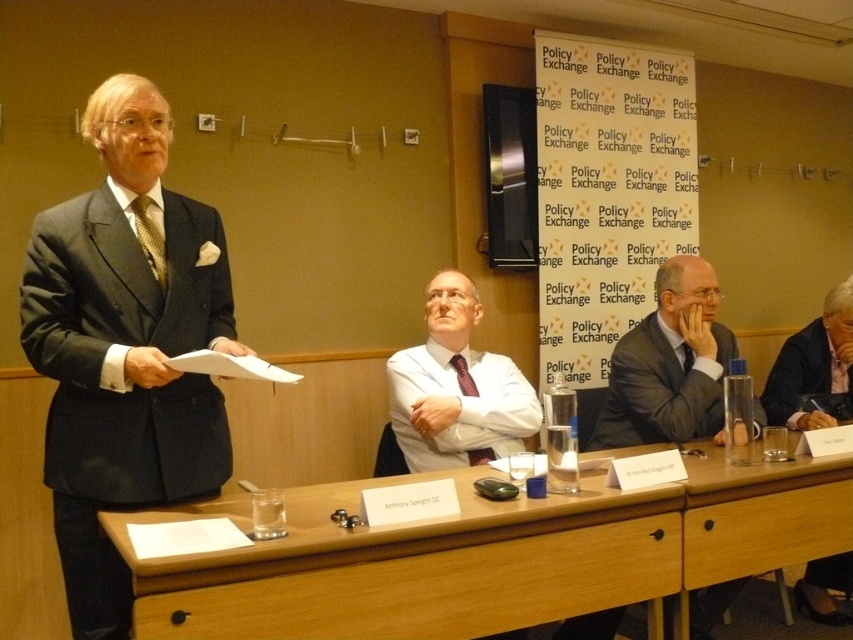
You are a photographer trying to capture a closeup of the speaker. You have two points marked in the image, point (149, 243) and point (474, 449). Which point should you focus on to get the closest possible shot of the speaker?

Point (149, 243) is closer to the camera than point (474, 449), so focusing on point (149, 243) will provide the closest possible shot of the speaker.